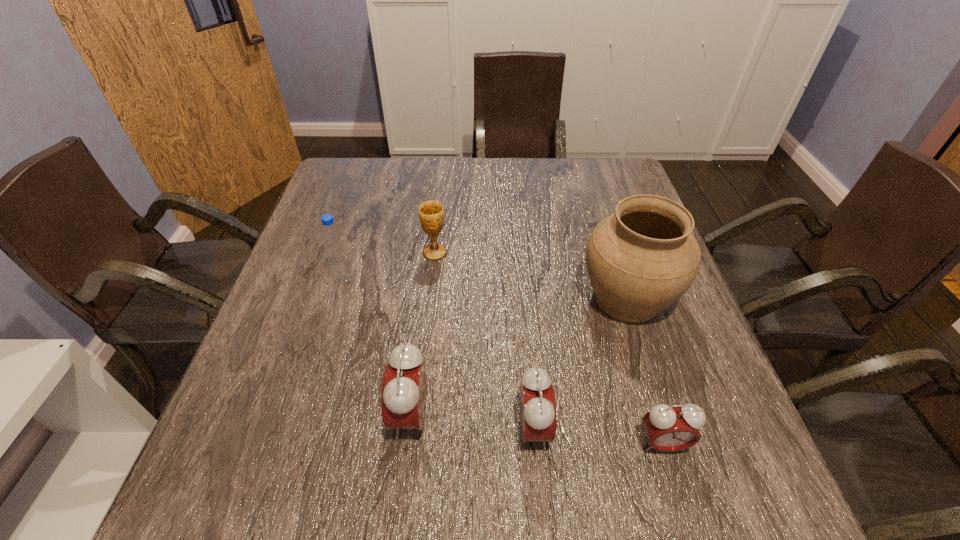
You are a GUI agent. You are given a task and a screenshot of the screen. Output one action in this format:
    pyautogui.click(x=<x>, y=<y>)
    Task: Click on the unoccupied position between the rightmost alarm clock and the second alarm clock from left to right
    
    Given the screenshot: What is the action you would take?
    pyautogui.click(x=598, y=436)

In order to click on free area in between the second shortest alarm clock and the farthest object in this screenshot , I will do `click(484, 341)`.

I want to click on empty location between the second alarm clock from left to right and the leftmost alarm clock, so click(x=472, y=422).

Where is `object that is the second nearest to the chalice`? Image resolution: width=960 pixels, height=540 pixels. object that is the second nearest to the chalice is located at coordinates (640, 260).

Choose which object is the fifth nearest neighbor to the farthest object. Please provide its 2D coordinates. Your answer should be formatted as a tuple, i.e. [(x, y)], where the tuple contains the x and y coordinates of a point satisfying the conditions above.

[(669, 428)]

I want to click on the second closest alarm clock to the urn, so click(669, 428).

Where is `the second closest alarm clock to the farthest object`? The width and height of the screenshot is (960, 540). the second closest alarm clock to the farthest object is located at coordinates (537, 406).

This screenshot has width=960, height=540. I want to click on vacant point that satisfies the following two spatial constraints: 1. on the front side of the chalice; 2. on the left side of the urn, so click(x=430, y=298).